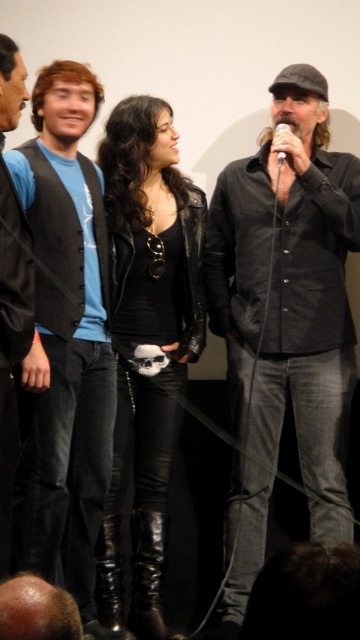
Question: Which object is closer to the camera taking this photo?

Choices:
 (A) white plastic microphone at upper center
 (B) matte black vest at left
 (C) smooth bald head at lower left

Answer: (C)

Question: Does black leather vest at left appear over smooth bald head at lower left?

Choices:
 (A) yes
 (B) no

Answer: (A)

Question: Is dark gray shirt at center above matte black vest at left?

Choices:
 (A) yes
 (B) no

Answer: (A)

Question: Can you confirm if matte black vest at left is smaller than black leather vest at left?

Choices:
 (A) no
 (B) yes

Answer: (A)

Question: Which of these objects is positioned farthest from the white plastic microphone at upper center?

Choices:
 (A) black leather jacket at center
 (B) matte black vest at left
 (C) black leather vest at left

Answer: (C)

Question: Which of these objects is positioned farthest from the dark gray shirt at center?

Choices:
 (A) black leather jacket at center
 (B) white plastic microphone at upper center
 (C) black leather vest at left
 (D) matte black vest at left

Answer: (C)